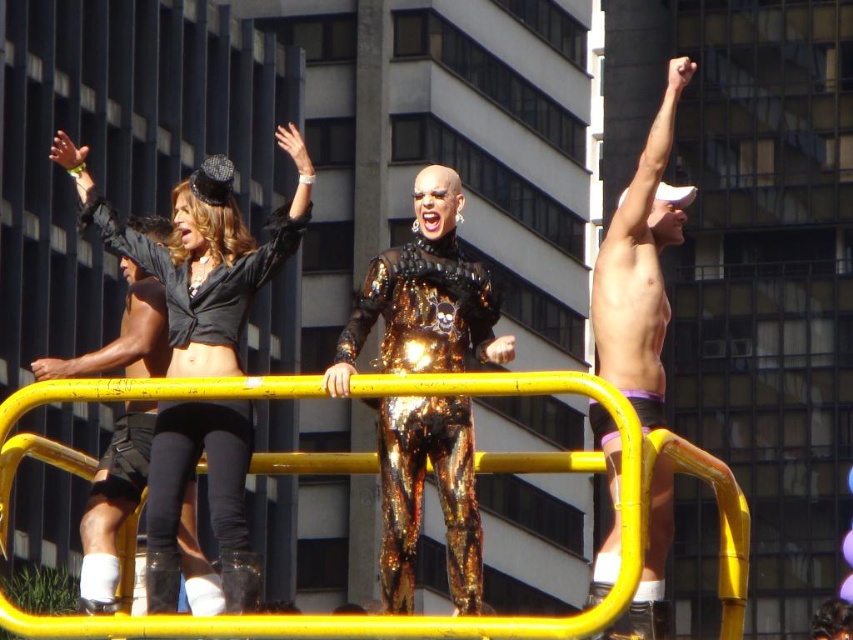
Is matte black top at upper left closer to camera compared to shiny metallic suit at center?

No, it is not.

Does matte black top at upper left appear under shiny metallic suit at center?

No, matte black top at upper left is not below shiny metallic suit at center.

Is point (193, 464) farther from viewer compared to point (445, 465)?

No, it is in front of (445, 465).

Find the location of a particular element. The width and height of the screenshot is (853, 640). matte black top at upper left is located at coordinates (202, 252).

Based on the photo, between shiny metallic suit at center and shiny metallic shorts at upper right, which one appears on the right side from the viewer's perspective?

From the viewer's perspective, shiny metallic shorts at upper right appears more on the right side.

Which is more to the left, shiny metallic suit at center or shiny metallic shorts at upper right?

Positioned to the left is shiny metallic suit at center.

Identify the location of shiny metallic suit at center. (424, 296).

Locate an element on the screen. The height and width of the screenshot is (640, 853). shiny metallic suit at center is located at coordinates (424, 296).

Is yellow metallic rail at center below shiny metallic suit at center?

Indeed, yellow metallic rail at center is positioned under shiny metallic suit at center.

Who is taller, yellow metallic rail at center or shiny metallic suit at center?

yellow metallic rail at center

Does point (595, 394) lie in front of point (439, 221)?

Yes, it is in front of point (439, 221).

At what (x,y) coordinates should I click in order to perform the action: click on yellow metallic rail at center. Please return your answer as a coordinate pair (x, y). Looking at the image, I should click on (486, 616).